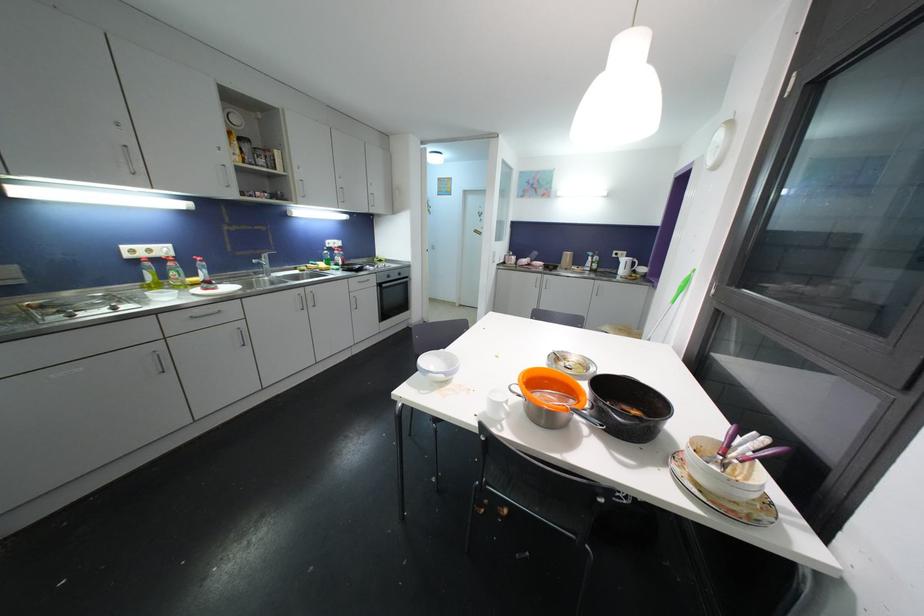
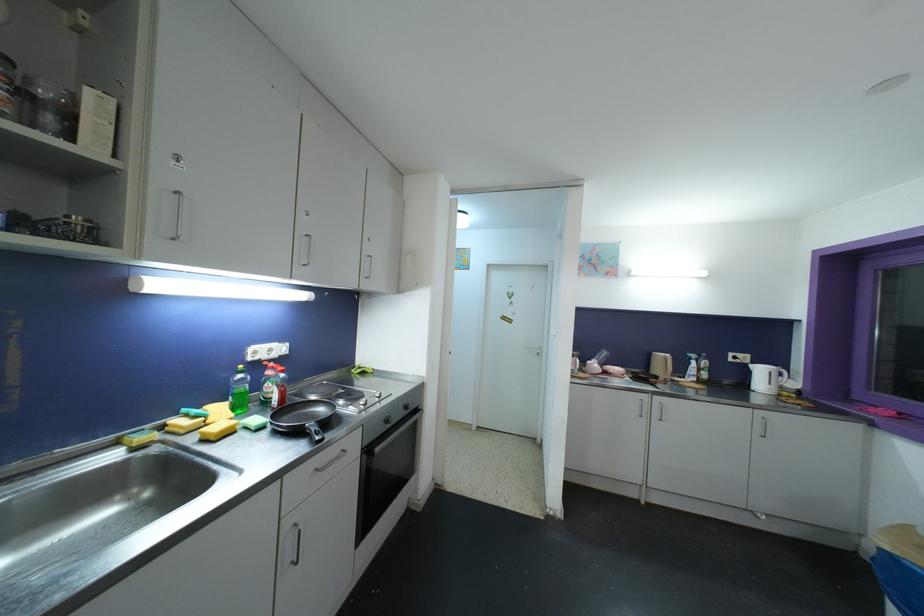
Where in the second image is the point corresponding to point (392, 280) from the first image?

(390, 424)